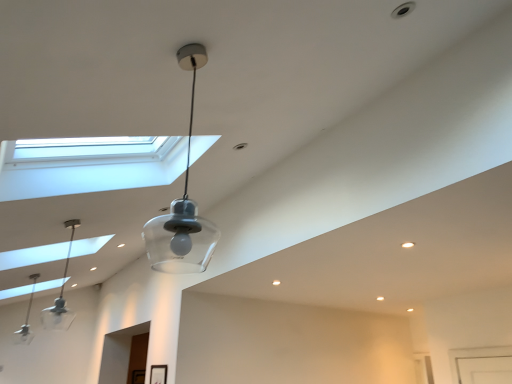
Question: From the image's perspective, is clear glass pendant light at left, which appears as the 2th lamp when viewed from the top, below clear glass pendant light at center, which is the 3th lamp in back-to-front order?

Choices:
 (A) yes
 (B) no

Answer: (A)

Question: From a real-world perspective, does clear glass pendant light at left, the 2th lamp from the front, sit lower than clear glass pendant light at center, which is the 1th lamp in right-to-left order?

Choices:
 (A) no
 (B) yes

Answer: (A)

Question: Is clear glass pendant light at left, which is counted as the 2th lamp, starting from the left, aimed at clear glass pendant light at center, which is the 1th lamp in right-to-left order?

Choices:
 (A) yes
 (B) no

Answer: (B)

Question: Is clear glass pendant light at left, which is the 2th lamp from bottom to top, behind clear glass pendant light at center, the 3th lamp when ordered from bottom to top?

Choices:
 (A) no
 (B) yes

Answer: (B)

Question: From the image's perspective, does clear glass pendant light at left, which is counted as the 2th lamp, starting from the left, appear higher than clear glass pendant light at center, which is the 3th lamp in back-to-front order?

Choices:
 (A) yes
 (B) no

Answer: (B)

Question: From the image's perspective, is clear glass pendant light at center, which is the 3th lamp in back-to-front order, above or below clear glass pendant light at left, the third lamp in the top-to-bottom sequence?

Choices:
 (A) above
 (B) below

Answer: (A)

Question: In terms of width, does clear glass pendant light at center, the 3th lamp when ordered from bottom to top, look wider or thinner when compared to clear glass pendant light at left, marked as the 3th lamp in a right-to-left arrangement?

Choices:
 (A) thin
 (B) wide

Answer: (A)

Question: Is point (194, 261) positioned closer to the camera than point (14, 334)?

Choices:
 (A) closer
 (B) farther

Answer: (A)

Question: Based on their sizes in the image, would you say clear glass pendant light at center, which appears as the 1th lamp when viewed from the front, is bigger or smaller than clear glass pendant light at left, positioned as the first lamp in back-to-front order?

Choices:
 (A) big
 (B) small

Answer: (B)

Question: Considering their positions, is clear glass pendant light at left, marked as the 3th lamp in a right-to-left arrangement, located in front of or behind clear glass pendant light at left, which appears as the 2th lamp when viewed from the top?

Choices:
 (A) behind
 (B) front

Answer: (A)

Question: From the image's perspective, is clear glass pendant light at left, the third lamp in the top-to-bottom sequence, above or below clear glass pendant light at left, which ranks as the second lamp in back-to-front order?

Choices:
 (A) above
 (B) below

Answer: (B)

Question: In terms of width, does clear glass pendant light at left, positioned as the first lamp in back-to-front order, look wider or thinner when compared to clear glass pendant light at left, which ranks as the second lamp in back-to-front order?

Choices:
 (A) wide
 (B) thin

Answer: (A)

Question: Is clear glass pendant light at left, the third lamp in the top-to-bottom sequence, situated inside clear glass pendant light at left, which is the 2th lamp from bottom to top, or outside?

Choices:
 (A) inside
 (B) outside

Answer: (B)

Question: Considering the positions of point (172, 264) and point (69, 221), is point (172, 264) closer or farther from the camera than point (69, 221)?

Choices:
 (A) farther
 (B) closer

Answer: (A)

Question: Considering the positions of clear glass pendant light at center, which is the 3th lamp in back-to-front order, and clear glass pendant light at left, which is counted as the 2th lamp, starting from the left, in the image, is clear glass pendant light at center, which is the 3th lamp in back-to-front order, taller or shorter than clear glass pendant light at left, which is counted as the 2th lamp, starting from the left,?

Choices:
 (A) tall
 (B) short

Answer: (A)